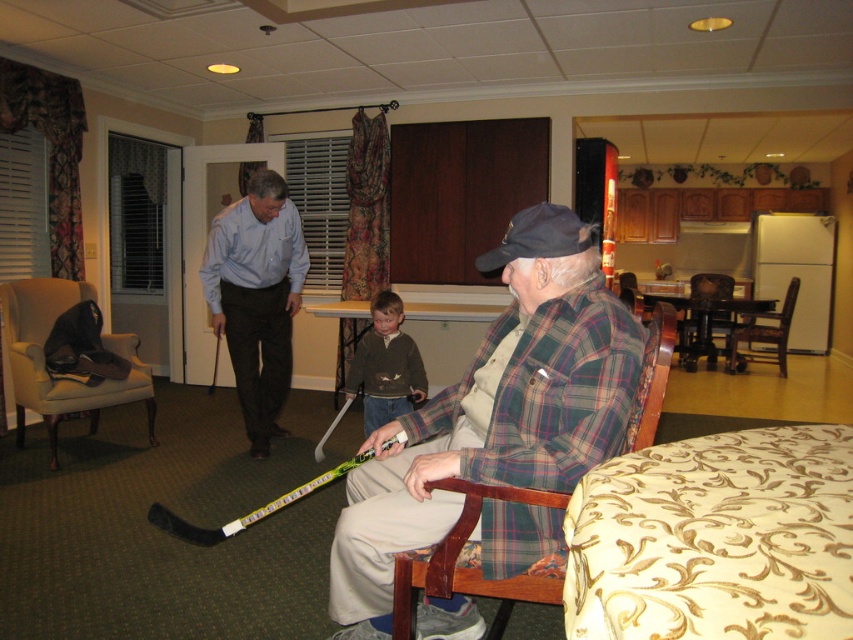
Question: From the image, what is the correct spatial relationship of plaid flannel shirt at center in relation to beige fabric wingback chair at left?

Choices:
 (A) above
 (B) below

Answer: (B)

Question: Is beige fabric wingback chair at left below black plastic hockey stick at center?

Choices:
 (A) yes
 (B) no

Answer: (A)

Question: Which point is closer to the camera?

Choices:
 (A) (347, 625)
 (B) (840, 508)
 (C) (277, 326)

Answer: (B)

Question: Among these points, which one is farthest from the camera?

Choices:
 (A) (215, 349)
 (B) (238, 529)
 (C) (62, 385)

Answer: (A)

Question: Can you confirm if plaid flannel shirt at center is thinner than dark brown sweater at center?

Choices:
 (A) no
 (B) yes

Answer: (A)

Question: Which is farther from the dark brown sweater at center?

Choices:
 (A) gold embroidered tablecloth at lower right
 (B) beige fabric wingback chair at left
 (C) plaid flannel shirt at center
 (D) light blue shirt at center

Answer: (A)